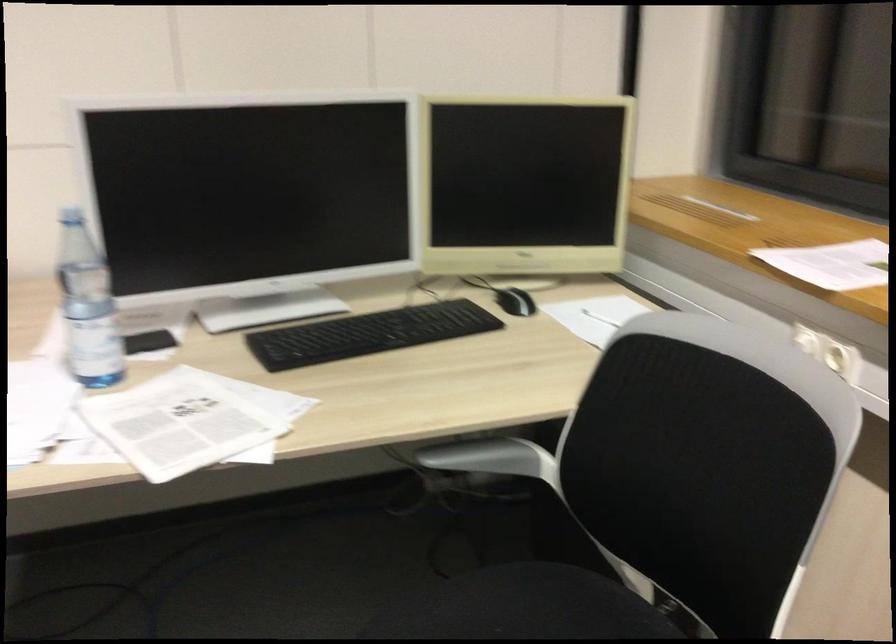
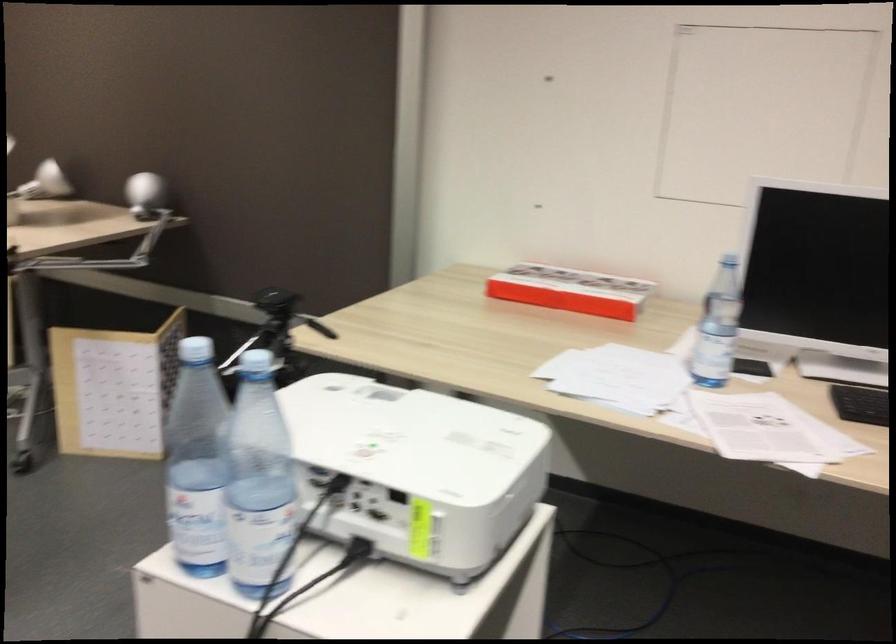
Question: The images are taken continuously from a first-person perspective. In which direction is your viewpoint rotating?

Choices:
 (A) Left
 (B) Right
 (C) Up
 (D) Down

Answer: (A)